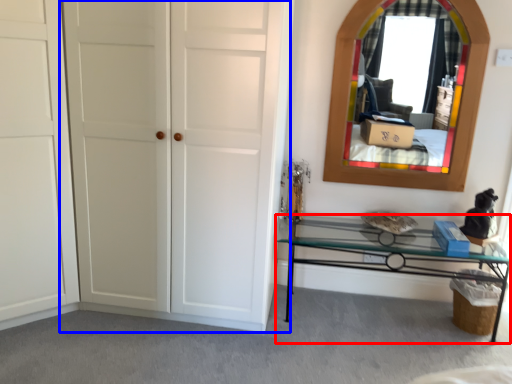
Question: Among these objects, which one is farthest to the camera, table (highlighted by a red box) or door (highlighted by a blue box)?

Choices:
 (A) table
 (B) door

Answer: (A)